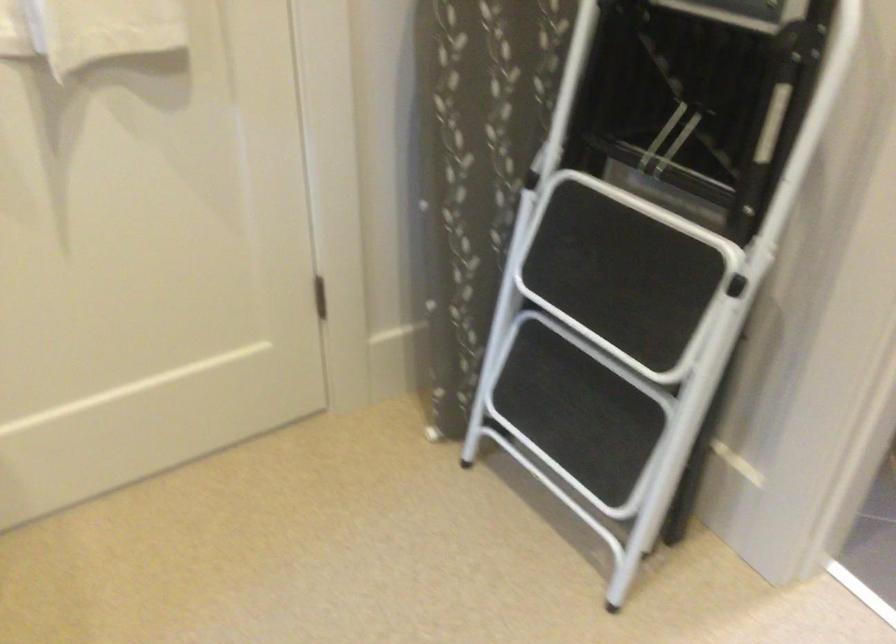
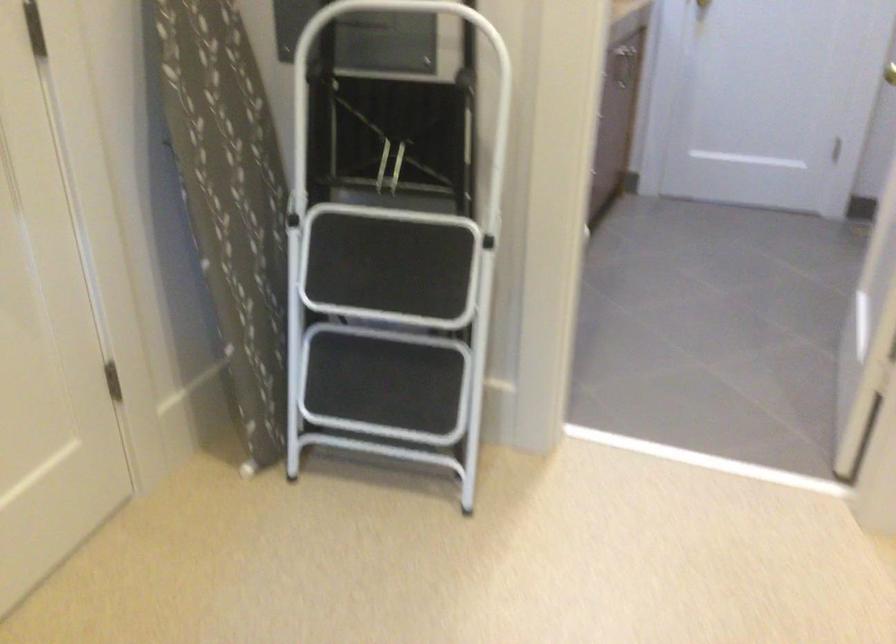
Where in the second image is the point corresponding to pixel 483 136 from the first image?

(229, 199)